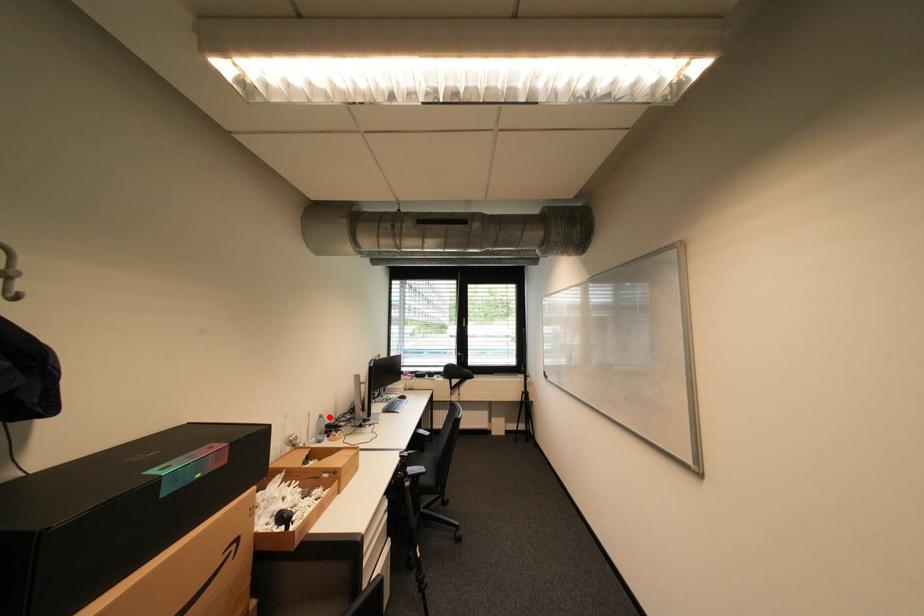
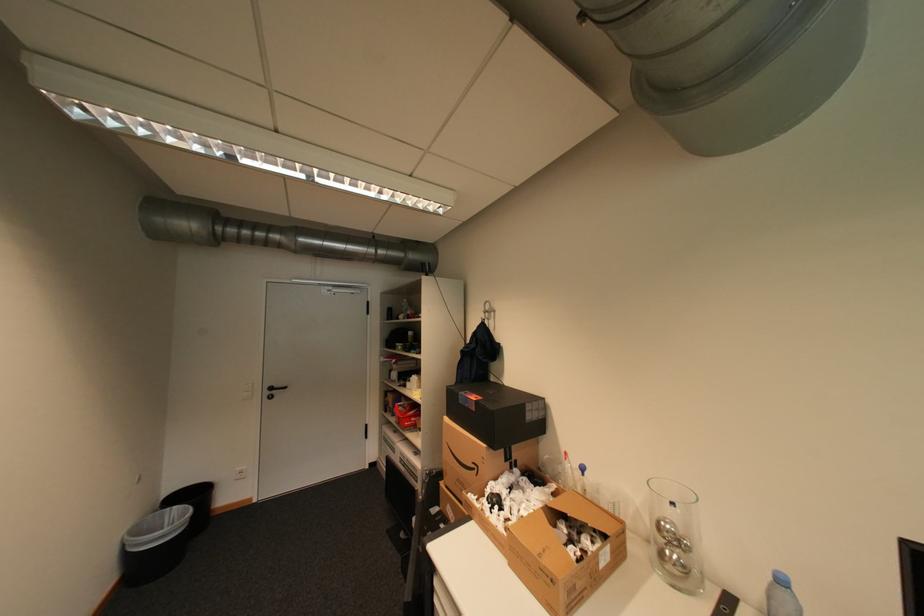
Question: I am providing you with two images of the same scene from different viewpoints. Image1 has a red point marked. In image2, the corresponding 3D location appears at what relative position? Reply with the corresponding letter.

Choices:
 (A) Closer
 (B) Farther

Answer: (B)